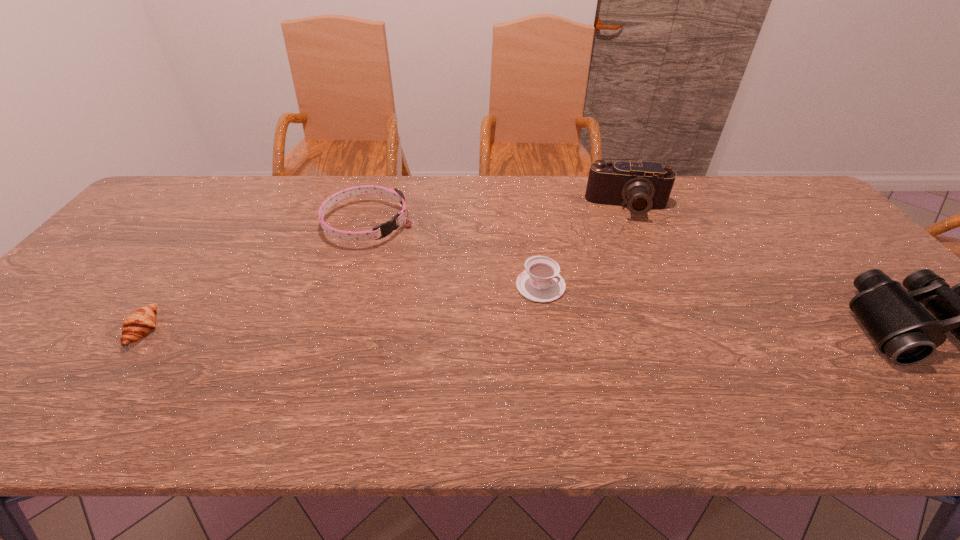
The width and height of the screenshot is (960, 540). What are the coordinates of `free location at the right edge` in the screenshot? It's located at [x=805, y=249].

You are a GUI agent. You are given a task and a screenshot of the screen. Output one action in this format:
    pyautogui.click(x=<x>, y=<y>)
    Task: Click on the vacant region at the far left corner of the desktop
    The width and height of the screenshot is (960, 540).
    Given the screenshot: What is the action you would take?
    pyautogui.click(x=182, y=208)

The image size is (960, 540). Identify the location of free area in between the third object from left to right and the fourth object from left to right. (584, 246).

Locate an element on the screen. This screenshot has height=540, width=960. free spot between the second object from right to left and the pastry is located at coordinates (386, 268).

I want to click on free space between the third object from left to right and the second object from left to right, so click(454, 255).

Where is `vacant space that's between the second object from left to right and the third object from left to right`? vacant space that's between the second object from left to right and the third object from left to right is located at coordinates (454, 255).

Identify the location of vacant area between the pastry and the camera. (386, 268).

Identify the location of unoccupied position between the second object from right to left and the fourth object from right to left. This screenshot has width=960, height=540. (498, 215).

Find the location of `object that is the second closest to the fourth object from left to right`. object that is the second closest to the fourth object from left to right is located at coordinates (902, 329).

Select which object is the second closest to the pastry. Please provide its 2D coordinates. Your answer should be formatted as a tuple, i.e. [(x, y)], where the tuple contains the x and y coordinates of a point satisfying the conditions above.

[(541, 282)]